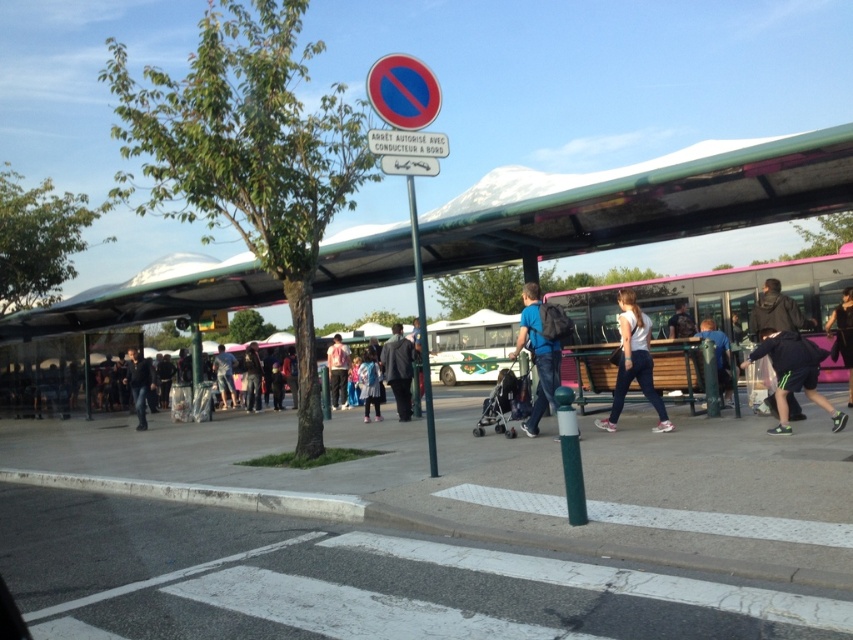
Question: Estimate the real-world distances between objects in this image. Which object is closer to the dark blue jeans at center?

Choices:
 (A) metallic pole at center
 (B) dark gray suit at center

Answer: (A)

Question: Can you confirm if matte blue shirt at center is positioned below dark blue jeans at lower left?

Choices:
 (A) yes
 (B) no

Answer: (B)

Question: Is gray asphalt at lower center above white matte shirt at center?

Choices:
 (A) yes
 (B) no

Answer: (B)

Question: Is pink metallic bus at center smaller than blue denim jacket at center?

Choices:
 (A) yes
 (B) no

Answer: (B)

Question: Which point is farther to the camera?

Choices:
 (A) dark blue jeans at center
 (B) dark gray suit at center
 (C) light blue denim jacket at center

Answer: (C)

Question: Which point is farther to the camera?

Choices:
 (A) dark blue jeans at lower left
 (B) gray asphalt at lower center
 (C) dark blue jeans at center

Answer: (A)